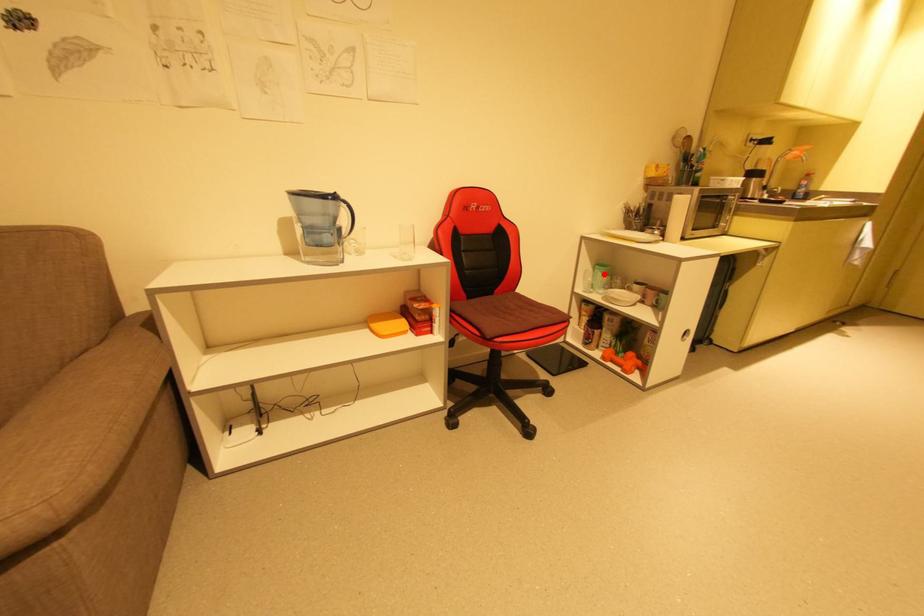
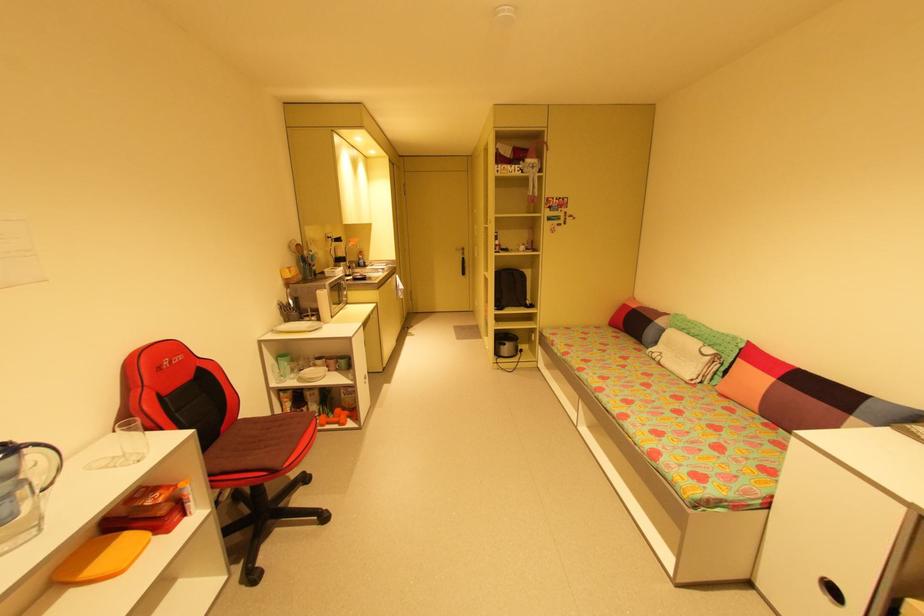
In the second image, find the point that corresponds to the highlighted location in the first image.

(290, 363)